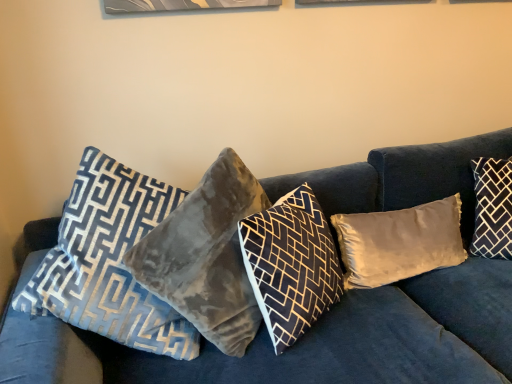
Question: Is velvet blue couch at center thinner than satin beige pillow at center, which is counted as the 2th pillow, starting from the right?

Choices:
 (A) yes
 (B) no

Answer: (B)

Question: Are velvet blue couch at center and satin beige pillow at center, which is counted as the 2th pillow, starting from the right, making contact?

Choices:
 (A) no
 (B) yes

Answer: (A)

Question: Does velvet blue couch at center appear on the right side of satin beige pillow at center, which appears as the fourth pillow when viewed from the left?

Choices:
 (A) no
 (B) yes

Answer: (A)

Question: Is satin beige pillow at center, which is counted as the 2th pillow, starting from the right, at the back of velvet blue couch at center?

Choices:
 (A) yes
 (B) no

Answer: (A)

Question: Does velvet blue couch at center have a lesser height compared to satin beige pillow at center, which appears as the fourth pillow when viewed from the left?

Choices:
 (A) yes
 (B) no

Answer: (B)

Question: Is satin beige pillow at center, which is counted as the 2th pillow, starting from the right, taller or shorter than velvet blue couch at center?

Choices:
 (A) tall
 (B) short

Answer: (B)

Question: From a real-world perspective, is satin beige pillow at center, which is counted as the 2th pillow, starting from the right, physically located above or below velvet blue couch at center?

Choices:
 (A) above
 (B) below

Answer: (A)

Question: Is point (381, 263) positioned closer to the camera than point (464, 375)?

Choices:
 (A) closer
 (B) farther

Answer: (B)

Question: Based on their positions, is satin beige pillow at center, which appears as the fourth pillow when viewed from the left, located to the left or right of velvet blue couch at center?

Choices:
 (A) left
 (B) right

Answer: (B)

Question: From the image's perspective, is satin beige pillow at center, which is counted as the 2th pillow, starting from the right, positioned above or below velvet gray pillow at center, positioned as the 4th pillow in right-to-left order?

Choices:
 (A) above
 (B) below

Answer: (B)

Question: Is satin beige pillow at center, which appears as the fourth pillow when viewed from the left, to the left or to the right of velvet gray pillow at center, acting as the 2th pillow starting from the left, in the image?

Choices:
 (A) left
 (B) right

Answer: (B)

Question: In the image, is satin beige pillow at center, which is counted as the 2th pillow, starting from the right, positioned in front of or behind velvet gray pillow at center, acting as the 2th pillow starting from the left?

Choices:
 (A) behind
 (B) front

Answer: (A)

Question: Is satin beige pillow at center, which is counted as the 2th pillow, starting from the right, inside or outside of velvet gray pillow at center, positioned as the 4th pillow in right-to-left order?

Choices:
 (A) inside
 (B) outside

Answer: (B)

Question: Considering their positions, is dark gray velvet pillow at right, the first pillow in the right-to-left sequence, located in front of or behind velvet gray pillow at center, positioned as the 4th pillow in right-to-left order?

Choices:
 (A) behind
 (B) front

Answer: (A)

Question: Do you think dark gray velvet pillow at right, the first pillow in the right-to-left sequence, is within velvet gray pillow at center, positioned as the 4th pillow in right-to-left order, or outside of it?

Choices:
 (A) outside
 (B) inside

Answer: (A)